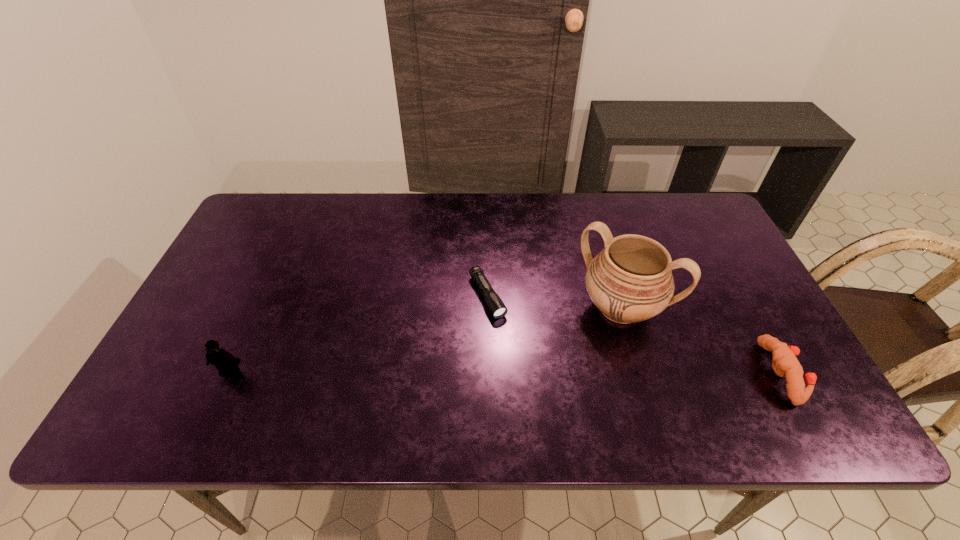
The height and width of the screenshot is (540, 960). In order to click on the leftmost object in this screenshot , I will do 225,362.

Where is `Lego`? Lego is located at coordinates (225, 362).

Locate an element on the screen. This screenshot has width=960, height=540. the rightmost object is located at coordinates (785, 364).

Locate an element on the screen. This screenshot has width=960, height=540. the third tallest object is located at coordinates (785, 364).

You are a GUI agent. You are given a task and a screenshot of the screen. Output one action in this format:
    pyautogui.click(x=<x>, y=<y>)
    Task: Click on the urn
    This screenshot has height=540, width=960.
    Given the screenshot: What is the action you would take?
    pyautogui.click(x=630, y=280)

Locate an element on the screen. This screenshot has width=960, height=540. the third object from left to right is located at coordinates pos(630,280).

The image size is (960, 540). I want to click on the shortest object, so click(x=497, y=308).

The width and height of the screenshot is (960, 540). Find the location of `flashlight`. flashlight is located at coordinates (497, 308).

The height and width of the screenshot is (540, 960). I want to click on vacant region located on the front-facing side of the third object from left to right, so 564,383.

Image resolution: width=960 pixels, height=540 pixels. What are the coordinates of `free location located on the front-facing side of the third object from left to right` in the screenshot? It's located at (563, 386).